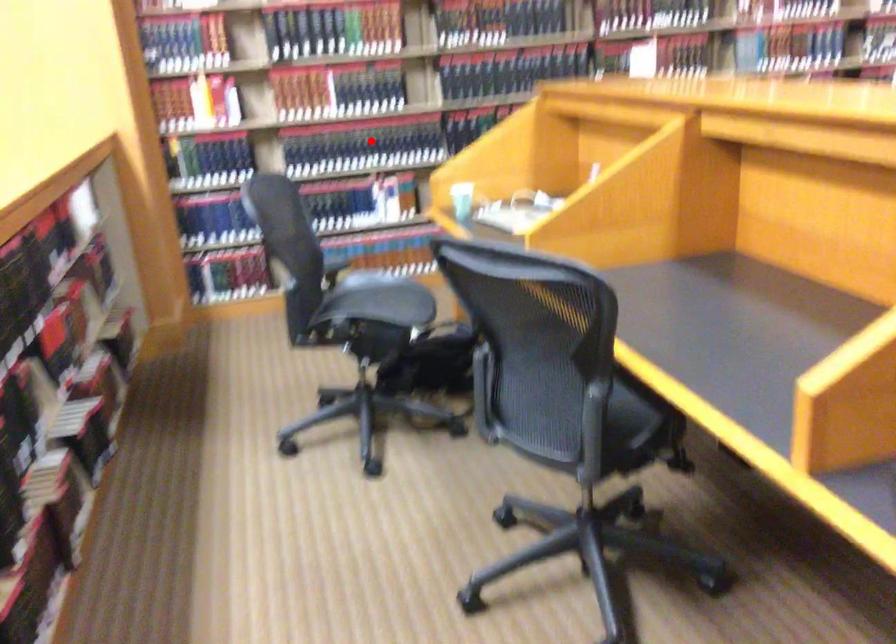
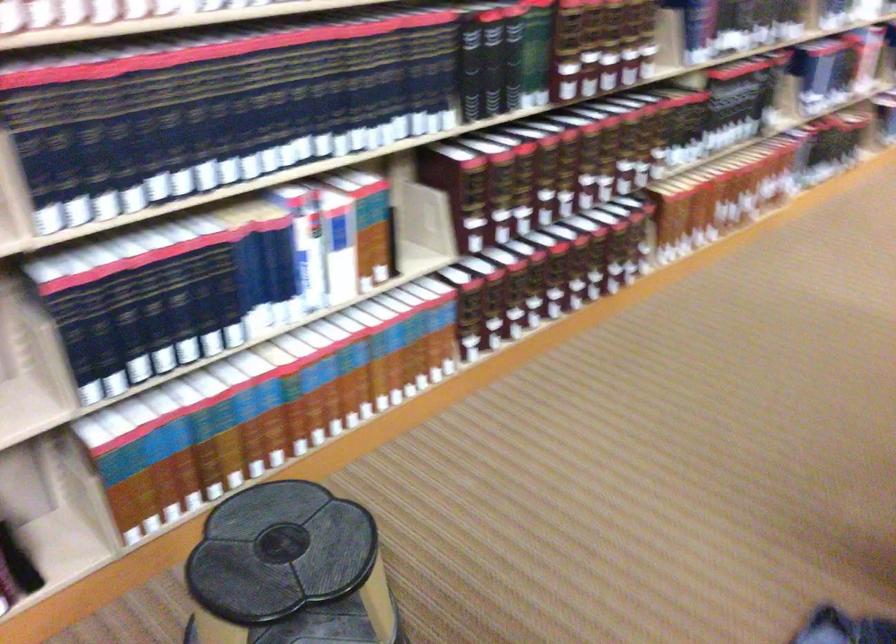
Where in the second image is the point corresponding to the highlighted location from the first image?

(297, 104)